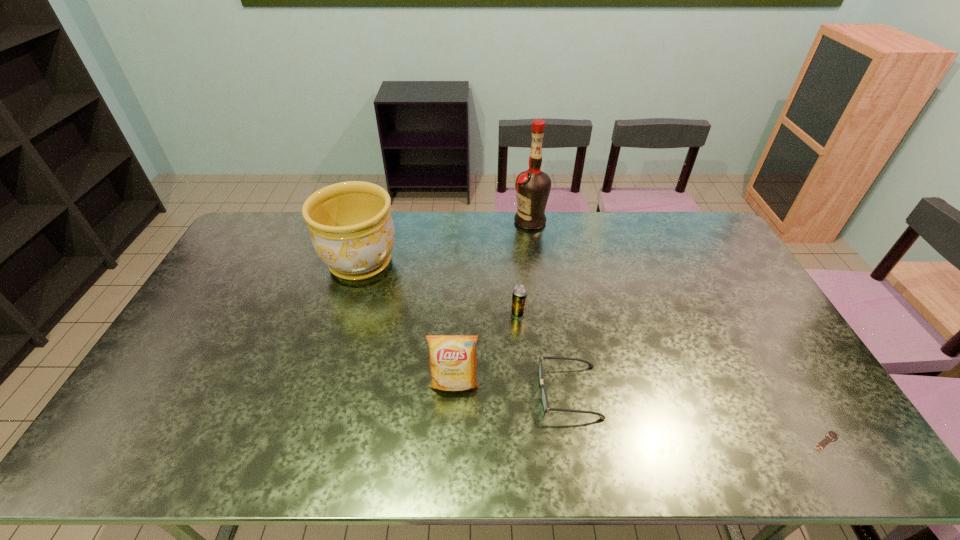
Identify the location of free space at the far left corner. The height and width of the screenshot is (540, 960). (295, 213).

Where is `vacant area at the far right corner`? This screenshot has height=540, width=960. vacant area at the far right corner is located at coordinates (693, 239).

You are a GUI agent. You are given a task and a screenshot of the screen. Output one action in this format:
    pyautogui.click(x=<x>, y=<y>)
    Task: Click on the free space between the shortest object and the spectacles
    
    Given the screenshot: What is the action you would take?
    pyautogui.click(x=697, y=417)

I want to click on vacant point located between the rightmost object and the beer can, so click(x=672, y=377).

At what (x,y) coordinates should I click in order to perform the action: click on vacant point located between the fourth tallest object and the fifth tallest object. Please return your answer as a coordinate pair (x, y). The height and width of the screenshot is (540, 960). Looking at the image, I should click on (543, 353).

This screenshot has width=960, height=540. Identify the location of vacant space that is in between the flowerpot and the third tallest object. (408, 323).

Where is `unoccupied position between the leftmost object and the spectacles`? The width and height of the screenshot is (960, 540). unoccupied position between the leftmost object and the spectacles is located at coordinates (465, 327).

Identify the location of empty space between the fifth tallest object and the tallest object. click(x=549, y=307).

Where is `free spot between the shortest object and the second shortest object`? The width and height of the screenshot is (960, 540). free spot between the shortest object and the second shortest object is located at coordinates (697, 417).

Identify the location of vacant area between the farthest object and the beer can. (524, 267).